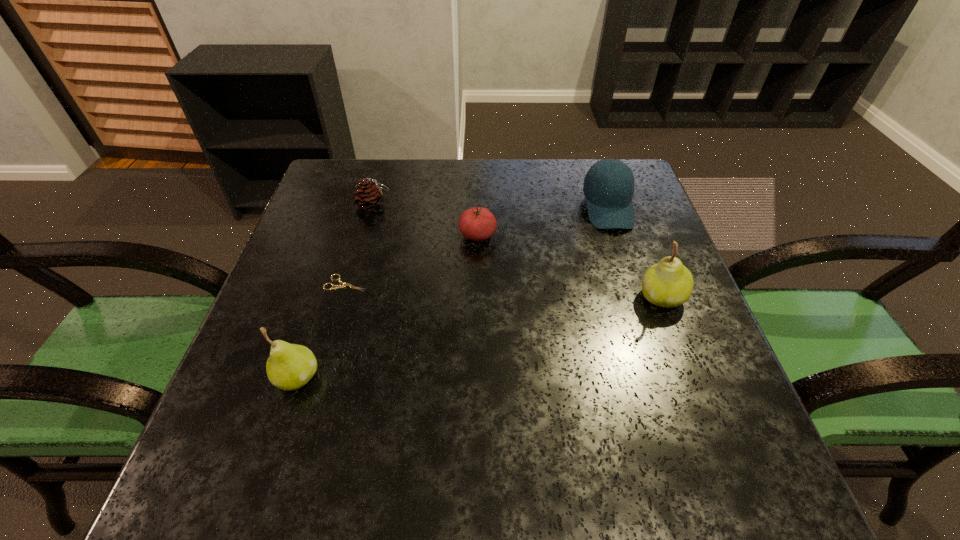
Find the location of a particular element. the left pear is located at coordinates click(x=290, y=366).

Locate an element on the screen. the nearer pear is located at coordinates (290, 366).

Identify the location of the tallest object. Image resolution: width=960 pixels, height=540 pixels. (669, 283).

Identify the location of the taller pear. This screenshot has width=960, height=540. (669, 283).

The width and height of the screenshot is (960, 540). In order to click on pinecone in this screenshot , I will do [x=369, y=196].

Where is `the fourth object from left to right`? the fourth object from left to right is located at coordinates (478, 224).

This screenshot has width=960, height=540. What are the coordinates of `the third tallest object` in the screenshot? It's located at (608, 187).

The width and height of the screenshot is (960, 540). I want to click on shears, so click(343, 285).

Identify the location of blank space located on the right of the shorter pear. Image resolution: width=960 pixels, height=540 pixels. (491, 377).

The height and width of the screenshot is (540, 960). Identify the location of vacant area situated on the back of the farther pear. (636, 228).